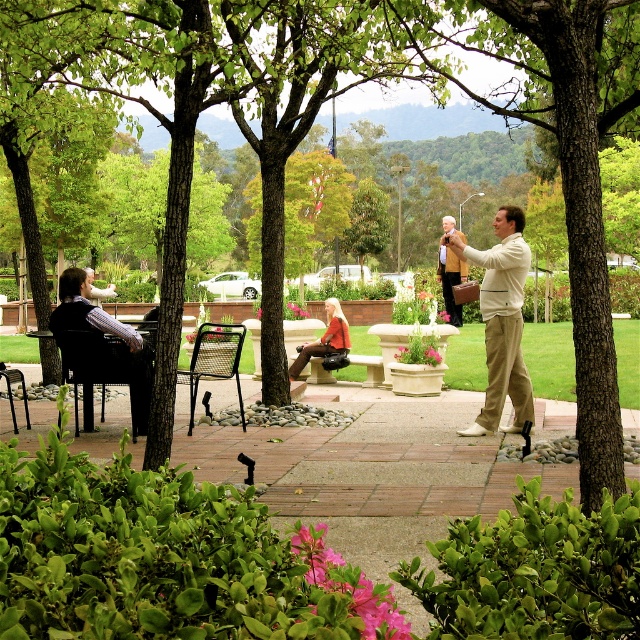
Question: Which point is closer to the camera?

Choices:
 (A) tan leather jacket at center
 (B) matte striped shirt at left

Answer: (B)

Question: Which object is closer to the camera taking this photo?

Choices:
 (A) matte black jacket at left
 (B) black mesh chair at left
 (C) tan leather jacket at center
 (D) leather handbag at center

Answer: (C)

Question: Which object appears closest to the camera in this image?

Choices:
 (A) matte striped shirt at left
 (B) tan leather jacket at center

Answer: (A)

Question: Is black mesh chair at left in front of leather handbag at center?

Choices:
 (A) no
 (B) yes

Answer: (B)

Question: Does black mesh chair at left have a greater width compared to matte striped shirt at left?

Choices:
 (A) no
 (B) yes

Answer: (A)

Question: Does tan leather jacket at center have a lesser width compared to black metal chair at left?

Choices:
 (A) no
 (B) yes

Answer: (A)